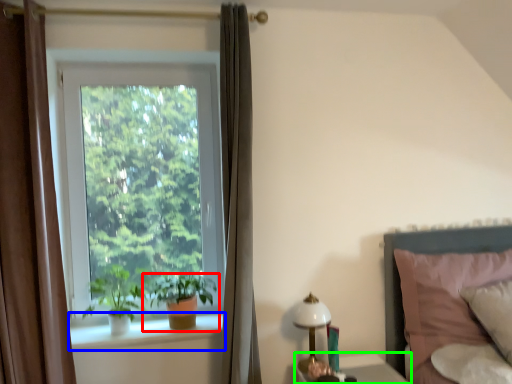
Question: Considering the real-world distances, which object is closest to houseplant (highlighted by a red box)? window sill (highlighted by a blue box) or table (highlighted by a green box).

Choices:
 (A) window sill
 (B) table

Answer: (A)